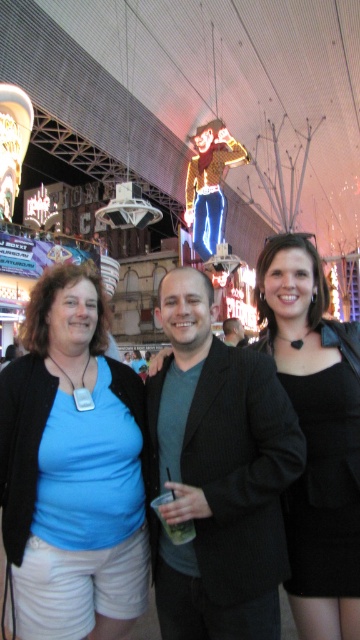
You are standing in the center of the marketplace and want to find the blue fabric shirt at center. According to the coordinates provided, which direction should you look to locate it?

The blue fabric shirt at center is located at point coordinates, so you should look towards the direction corresponding to those coordinates to find it.

You are a photographer trying to capture a photo of the black pinstripe suit at center and the black matte dress at center. Which one should you focus on first if you want to start with the one closer to the left side?

The black pinstripe suit at center is to the left of the black matte dress at center, so you should focus on the black pinstripe suit at center first.